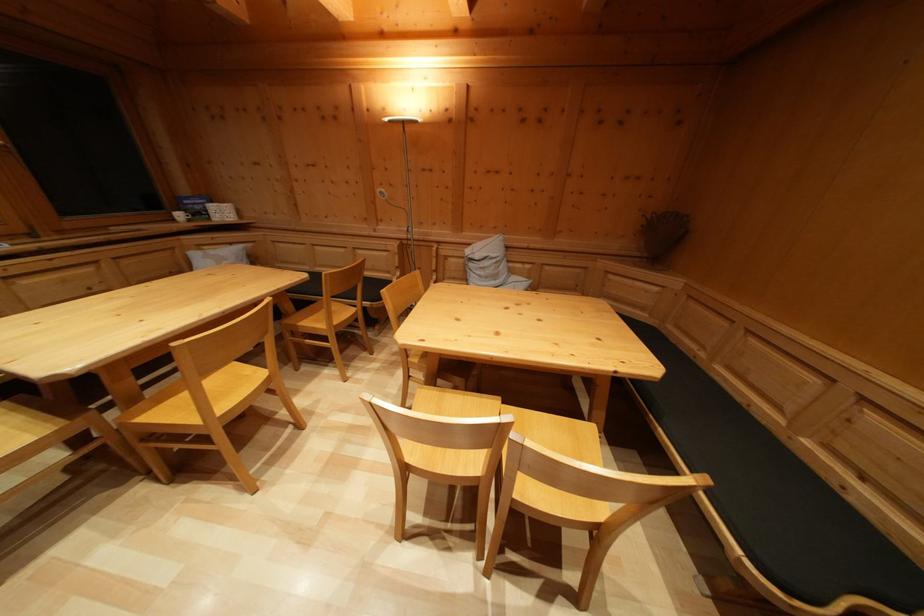
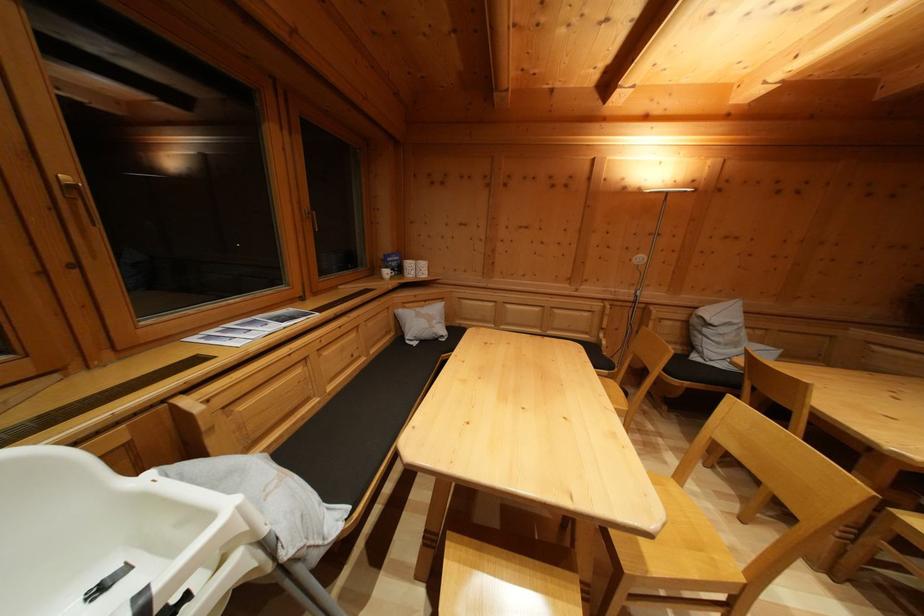
Where in the second image is the point corresponding to point (200, 211) from the first image?

(397, 268)